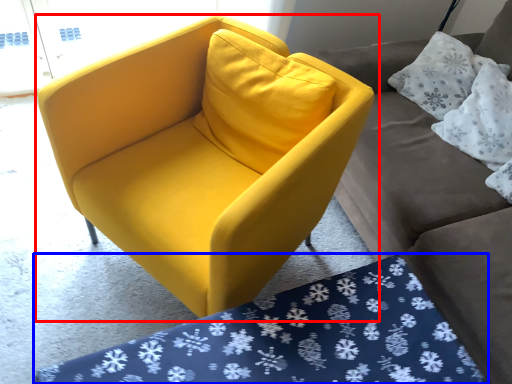
Question: Which of the following is the farthest to the observer, chair (highlighted by a red box) or mat (highlighted by a blue box)?

Choices:
 (A) chair
 (B) mat

Answer: (A)